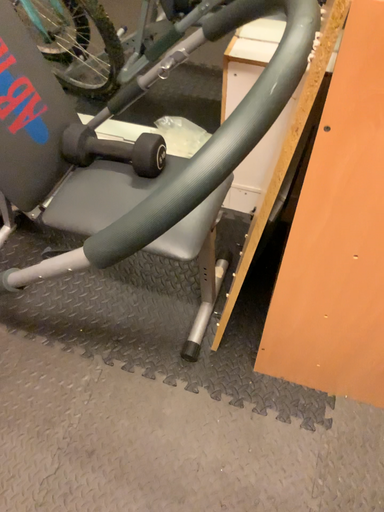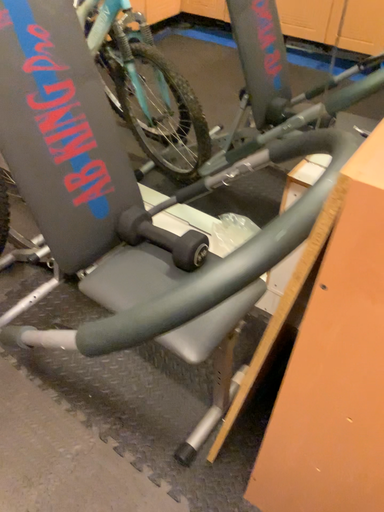
Question: How did the camera likely rotate when shooting the video?

Choices:
 (A) rotated downward
 (B) rotated upward

Answer: (B)